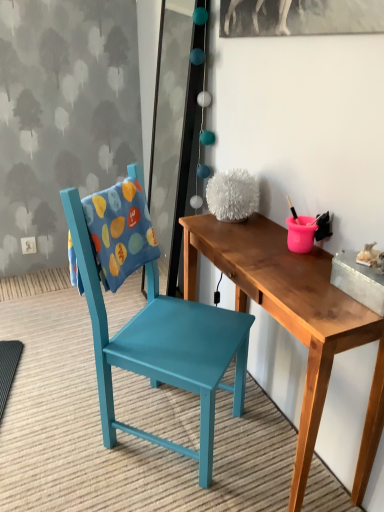
You are a GUI agent. You are given a task and a screenshot of the screen. Output one action in this format:
    pyautogui.click(x=<x>, y=<y>)
    Task: Click on the wooden table at center
    
    Given the screenshot: What is the action you would take?
    pyautogui.click(x=295, y=321)

The width and height of the screenshot is (384, 512). What do you see at coordinates (295, 321) in the screenshot?
I see `wooden table at center` at bounding box center [295, 321].

Locate an element on the screen. The width and height of the screenshot is (384, 512). teal painted wood chair at left is located at coordinates (162, 347).

Describe the element at coordinates (162, 347) in the screenshot. I see `teal painted wood chair at left` at that location.

What are the coordinates of `wooden table at center` in the screenshot? It's located at (295, 321).

Is teal painted wood chair at left to the left of wooden table at center from the viewer's perspective?

Indeed, teal painted wood chair at left is positioned on the left side of wooden table at center.

Which object is further away from the camera taking this photo, teal painted wood chair at left or wooden table at center?

teal painted wood chair at left is more distant.

Is point (244, 334) closer to camera compared to point (248, 231)?

That is True.

From the image's perspective, between teal painted wood chair at left and wooden table at center, who is located below?

wooden table at center appears lower in the image.

From a real-world perspective, which object stands above the other?

From a 3D spatial view, teal painted wood chair at left is above.

Considering the relative sizes of teal painted wood chair at left and wooden table at center in the image provided, is teal painted wood chair at left thinner than wooden table at center?

No, teal painted wood chair at left is not thinner than wooden table at center.

Is teal painted wood chair at left taller than wooden table at center?

Yes.

Between teal painted wood chair at left and wooden table at center, which one has smaller size?

With smaller size is wooden table at center.

Is wooden table at center surrounded by teal painted wood chair at left?

Definitely not — wooden table at center is not inside teal painted wood chair at left.

Is the surface of teal painted wood chair at left in direct contact with wooden table at center?

They are not placed beside each other.

In the scene shown: Could you tell me if teal painted wood chair at left is turned towards wooden table at center?

Yes, teal painted wood chair at left is oriented towards wooden table at center.

What's the angular difference between teal painted wood chair at left and wooden table at center's facing directions?

teal painted wood chair at left and wooden table at center are facing 130 degrees away from each other.

Locate an element on the screen. chair lying above the wooden table at center (from the image's perspective) is located at coordinates (162, 347).

Is wooden table at center at the right side of teal painted wood chair at left?

Yes, wooden table at center is to the right of teal painted wood chair at left.

Considering the positions of objects wooden table at center and teal painted wood chair at left in the image provided, who is behind, wooden table at center or teal painted wood chair at left?

teal painted wood chair at left is further from the camera.

Which point is more forward, (304, 326) or (94, 297)?

The point (304, 326) is in front.

From the image's perspective, would you say wooden table at center is shown under teal painted wood chair at left?

Yes.

From a real-world perspective, is wooden table at center positioned above or below teal painted wood chair at left?

wooden table at center is situated lower than teal painted wood chair at left in the real world.

Between wooden table at center and teal painted wood chair at left, which one has smaller width?

With smaller width is wooden table at center.

Considering the relative sizes of wooden table at center and teal painted wood chair at left in the image provided, is wooden table at center taller than teal painted wood chair at left?

Incorrect, the height of wooden table at center is not larger of that of teal painted wood chair at left.

Based on their sizes in the image, would you say wooden table at center is bigger or smaller than teal painted wood chair at left?

Clearly, wooden table at center is smaller in size than teal painted wood chair at left.

Do you think wooden table at center is within teal painted wood chair at left, or outside of it?

wooden table at center is located beyond the bounds of teal painted wood chair at left.

Is wooden table at center far from teal painted wood chair at left?

wooden table at center is actually quite close to teal painted wood chair at left.

Is wooden table at center looking in the opposite direction of teal painted wood chair at left?

Yes.

How many degrees apart are the facing directions of wooden table at center and teal painted wood chair at left?

130 degrees.

This screenshot has width=384, height=512. In order to click on table that appears below the teal painted wood chair at left (from a real-world perspective) in this screenshot , I will do pyautogui.click(x=295, y=321).

Locate an element on the screen. Image resolution: width=384 pixels, height=512 pixels. table to the right of teal painted wood chair at left is located at coordinates (295, 321).

Find the location of `chair behind the wooden table at center`. chair behind the wooden table at center is located at coordinates (162, 347).